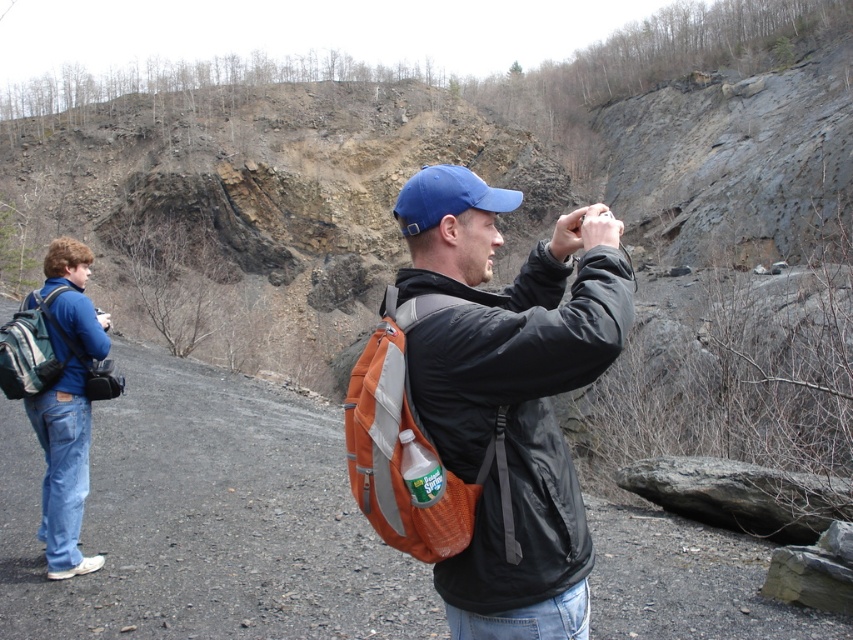
Question: Which object is the closest to the blue fabric baseball cap at center?

Choices:
 (A) green fabric backpack at left
 (B) blue denim jeans at left
 (C) orange fabric backpack at center
 (D) matte black jacket at center

Answer: (D)

Question: Can you confirm if orange fabric backpack at center is positioned below green fabric backpack at left?

Choices:
 (A) yes
 (B) no

Answer: (A)

Question: Which of these objects is positioned closest to the blue fabric baseball cap at center?

Choices:
 (A) orange fabric backpack at center
 (B) green fabric backpack at left
 (C) blue denim jeans at left
 (D) matte black jacket at center

Answer: (D)

Question: Among these objects, which one is nearest to the camera?

Choices:
 (A) blue fabric baseball cap at center
 (B) orange fabric backpack at center

Answer: (B)

Question: Can you confirm if matte black jacket at center is wider than blue fabric baseball cap at center?

Choices:
 (A) no
 (B) yes

Answer: (A)

Question: Does matte black jacket at center have a larger size compared to blue fabric baseball cap at center?

Choices:
 (A) yes
 (B) no

Answer: (B)